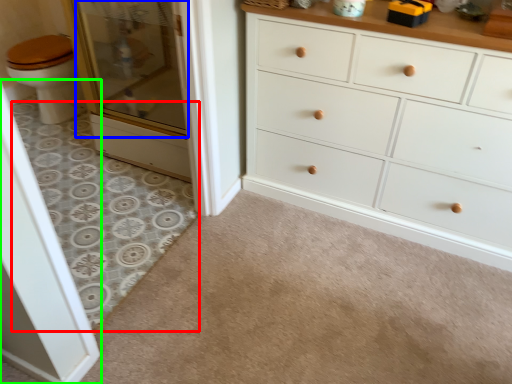
Question: Which object is positioned closest to plain (highlighted by a red box)? Select from screen door (highlighted by a blue box) and screen door (highlighted by a green box).

Choices:
 (A) screen door
 (B) screen door

Answer: (A)